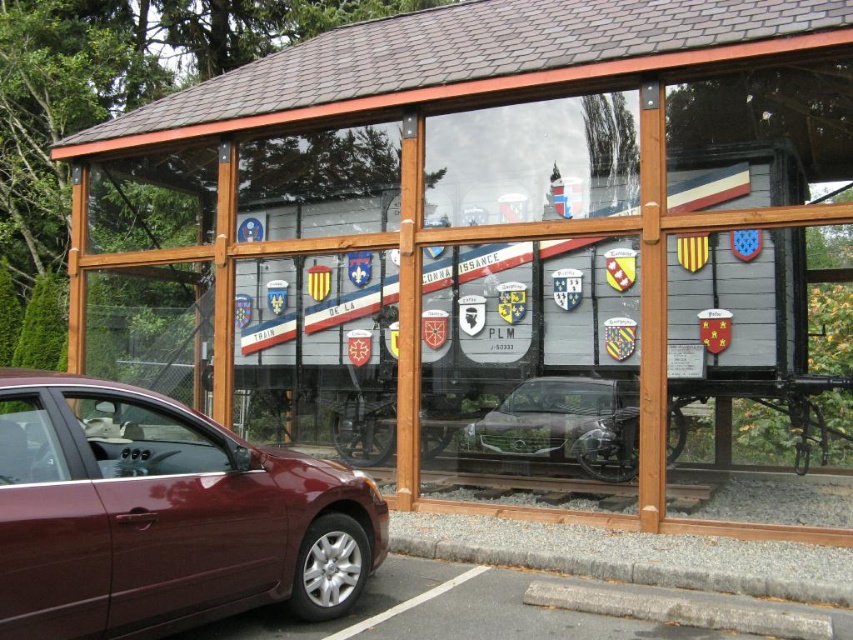
Question: Can you confirm if gray asphalt at lower left is positioned to the left of satin silver car at center?

Choices:
 (A) yes
 (B) no

Answer: (A)

Question: Which object is closer to the camera taking this photo?

Choices:
 (A) satin silver car at center
 (B) gray asphalt at lower left
 (C) satin burgundy sedan at lower left

Answer: (C)

Question: Does satin burgundy sedan at lower left appear under satin silver car at center?

Choices:
 (A) yes
 (B) no

Answer: (B)

Question: Considering the relative positions of gray asphalt at lower left and satin silver car at center in the image provided, where is gray asphalt at lower left located with respect to satin silver car at center?

Choices:
 (A) left
 (B) right

Answer: (A)

Question: Which is nearer to the satin burgundy sedan at lower left?

Choices:
 (A) satin silver car at center
 (B) gray asphalt at lower left

Answer: (B)

Question: Among these points, which one is nearest to the camera?

Choices:
 (A) click(532, 385)
 (B) click(281, 595)
 (C) click(514, 596)

Answer: (B)